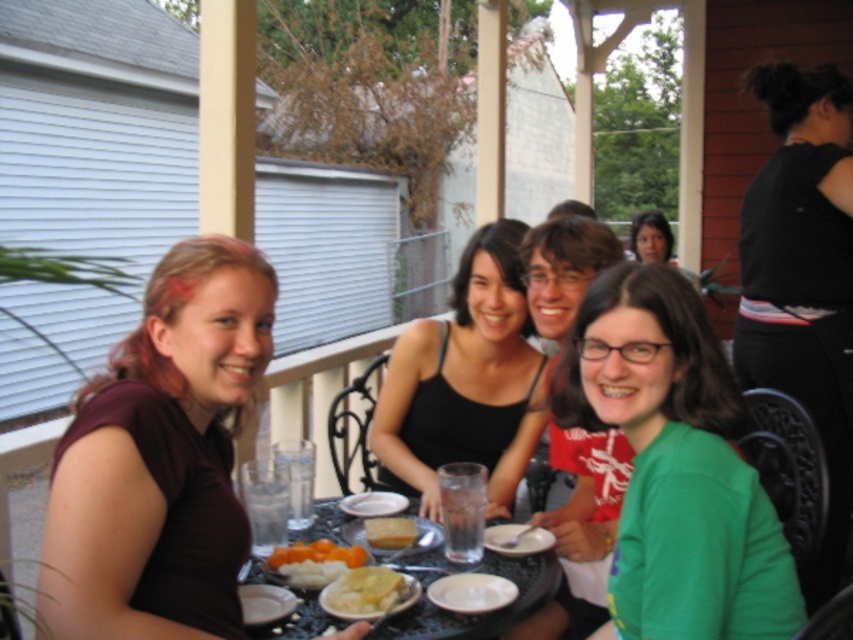
Question: Among these points, which one is nearest to the camera?

Choices:
 (A) (335, 582)
 (B) (660, 227)
 (C) (285, 632)
 (D) (483, 592)

Answer: (C)

Question: Which of the following is the closest to the observer?

Choices:
 (A) (314, 582)
 (B) (491, 282)
 (C) (633, 250)

Answer: (A)

Question: Which point is closer to the camera?

Choices:
 (A) (405, 538)
 (B) (688, 307)

Answer: (B)

Question: Can you confirm if black fabric shirt at upper right is positioned above white creamy mashed potatoes at center?

Choices:
 (A) no
 (B) yes

Answer: (B)

Question: Is the position of white creamy mashed potatoes at center less distant than that of matte black tank top at center?

Choices:
 (A) no
 (B) yes

Answer: (B)

Question: Where is green matte shirt at lower right located in relation to matte black tank top at center in the image?

Choices:
 (A) right
 (B) left

Answer: (B)